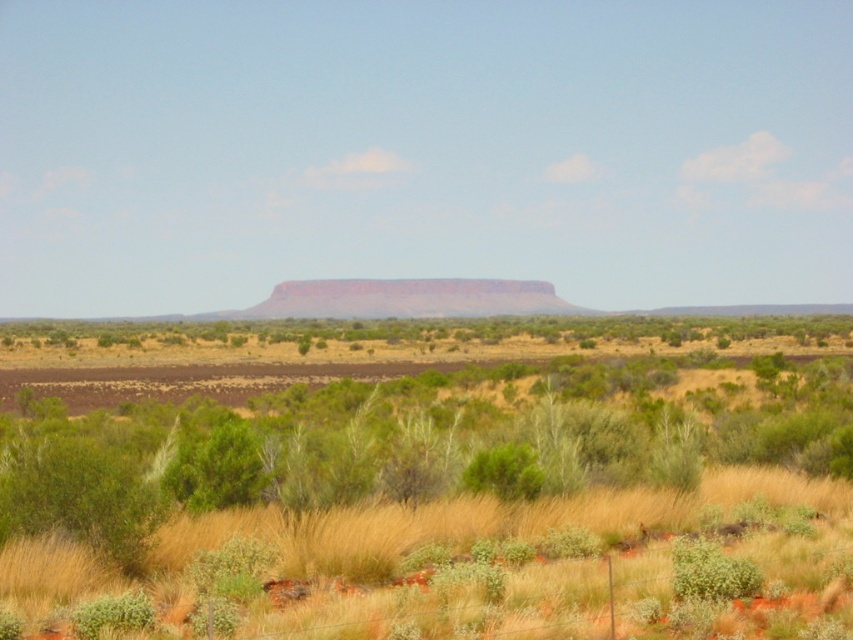
Based on the scene description, where is the grassy plain at center located in terms of coordinates?

Answer: The grassy plain at center is located at coordinates point [424,484].

You are a hiker trying to navigate through the desert. You see a green fuzzy bush at lower right and a green leafy bush at center. Which bush is wider?

The green leafy bush at center is wider than the green fuzzy bush at lower right.